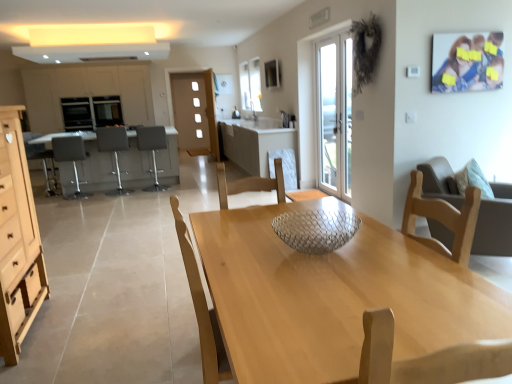
Question: Does light wood table at center have a larger size compared to gray fabric bar stool at left, the second chair from the left?

Choices:
 (A) no
 (B) yes

Answer: (B)

Question: Considering the relative sizes of light wood table at center and gray fabric bar stool at left, which is the 2th chair from front to back, in the image provided, is light wood table at center shorter than gray fabric bar stool at left, which is the 2th chair from front to back,?

Choices:
 (A) no
 (B) yes

Answer: (B)

Question: Can you see light wood table at center touching gray fabric bar stool at left, which is the 2th chair from front to back?

Choices:
 (A) no
 (B) yes

Answer: (A)

Question: From the image's perspective, is light wood table at center on top of gray fabric bar stool at left, which is the 2th chair from front to back?

Choices:
 (A) yes
 (B) no

Answer: (B)

Question: From a real-world perspective, is light wood table at center over gray fabric bar stool at left, which is the 2th chair from front to back?

Choices:
 (A) yes
 (B) no

Answer: (B)

Question: From the image's perspective, is matte gray cabinetry at left, acting as the 1th cabinetry starting from the left, above or below white glass door at center?

Choices:
 (A) below
 (B) above

Answer: (B)

Question: Based on their sizes in the image, would you say matte gray cabinetry at left, acting as the 1th cabinetry starting from the left, is bigger or smaller than white glass door at center?

Choices:
 (A) big
 (B) small

Answer: (A)

Question: Would you say matte gray cabinetry at left, acting as the 1th cabinetry starting from the left, is to the left or to the right of white glass door at center in the picture?

Choices:
 (A) left
 (B) right

Answer: (A)

Question: In the image, is matte gray cabinetry at left, acting as the 1th cabinetry starting from the left, positioned in front of or behind white glass door at center?

Choices:
 (A) front
 (B) behind

Answer: (B)

Question: Does point (18, 296) appear closer or farther from the camera than point (97, 124)?

Choices:
 (A) farther
 (B) closer

Answer: (B)

Question: From a real-world perspective, is wooden drawer at lower left, which is counted as the 1th drawer, starting from the front, above or below matte black oven at left, the 2th appliance when ordered from left to right?

Choices:
 (A) above
 (B) below

Answer: (B)

Question: Is wooden drawer at lower left, which is counted as the 1th drawer, starting from the front, wider or thinner than matte black oven at left, placed as the 1th appliance when sorted from right to left?

Choices:
 (A) wide
 (B) thin

Answer: (B)

Question: Based on their positions, is wooden drawer at lower left, which is counted as the 1th drawer, starting from the front, located to the left or right of matte black oven at left, the 2th appliance when ordered from left to right?

Choices:
 (A) left
 (B) right

Answer: (B)

Question: In terms of size, does white marble cabinet at center, which appears as the first cabinetry when viewed from the right, appear bigger or smaller than light wood dresser at left, which is counted as the 1th cabinetry, starting from the front?

Choices:
 (A) small
 (B) big

Answer: (B)

Question: From a real-world perspective, is white marble cabinet at center, which appears as the first cabinetry when viewed from the right, above or below light wood dresser at left, positioned as the 3th cabinetry in back-to-front order?

Choices:
 (A) below
 (B) above

Answer: (A)